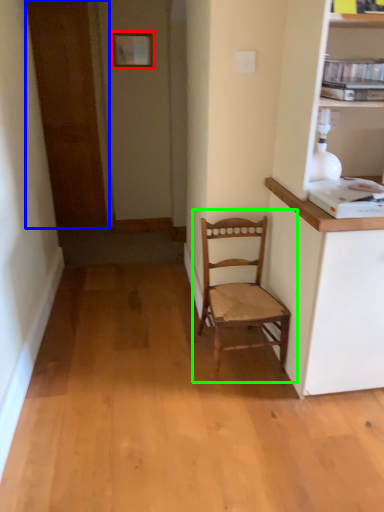
Question: Based on their relative distances, which object is farther from picture frame (highlighted by a red box)? Choose from door (highlighted by a blue box) and chair (highlighted by a green box).

Choices:
 (A) door
 (B) chair

Answer: (B)